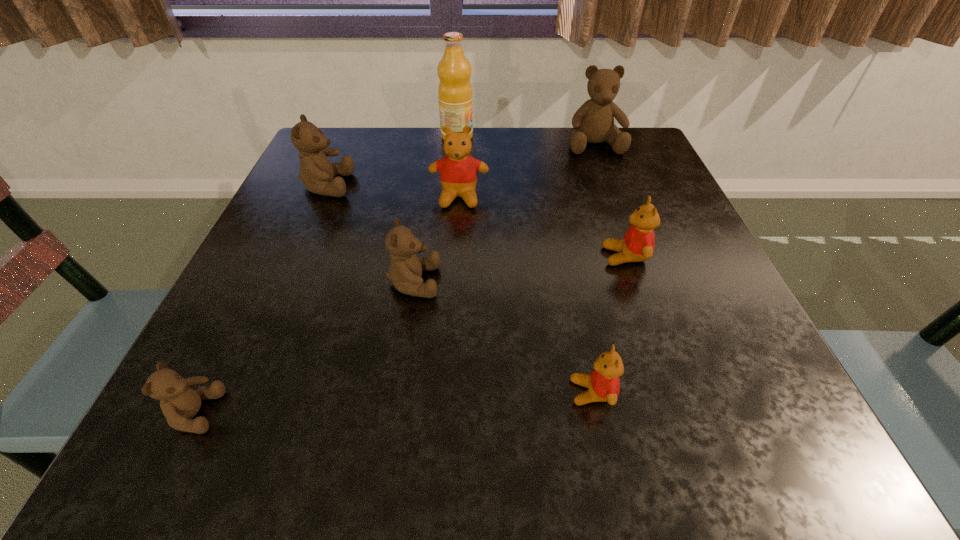
Find the location of a particular element. The width and height of the screenshot is (960, 540). unoccupied area between the third smallest brown teddy bear and the second brown teddy bear from right to left is located at coordinates (371, 234).

The height and width of the screenshot is (540, 960). What are the coordinates of `free space between the rightmost red teddy bear and the fruit juice` in the screenshot? It's located at (541, 197).

Identify which object is the fourth nearest to the farthest red teddy bear. Please provide its 2D coordinates. Your answer should be formatted as a tuple, i.e. [(x, y)], where the tuple contains the x and y coordinates of a point satisfying the conditions above.

[(638, 243)]

Locate an element on the screen. Image resolution: width=960 pixels, height=540 pixels. object that is the third closest to the third biggest brown teddy bear is located at coordinates (603, 383).

Where is `the third closest teddy bear to the seventh shortest object`? the third closest teddy bear to the seventh shortest object is located at coordinates (405, 271).

Identify which teddy bear is located as the fourth nearest to the biggest red teddy bear. Please provide its 2D coordinates. Your answer should be formatted as a tuple, i.e. [(x, y)], where the tuple contains the x and y coordinates of a point satisfying the conditions above.

[(593, 122)]

Where is `brown teddy bear that stands as the second closest to the second tallest object`? Image resolution: width=960 pixels, height=540 pixels. brown teddy bear that stands as the second closest to the second tallest object is located at coordinates (316, 171).

Identify the location of brown teddy bear that is the closest to the biggest brown teddy bear. Image resolution: width=960 pixels, height=540 pixels. [x=405, y=271].

Find the location of a particular element. red teddy bear that is the second closest to the smallest brown teddy bear is located at coordinates [458, 171].

Locate an element on the screen. Image resolution: width=960 pixels, height=540 pixels. red teddy bear object that ranks as the closest to the rightmost brown teddy bear is located at coordinates (458, 171).